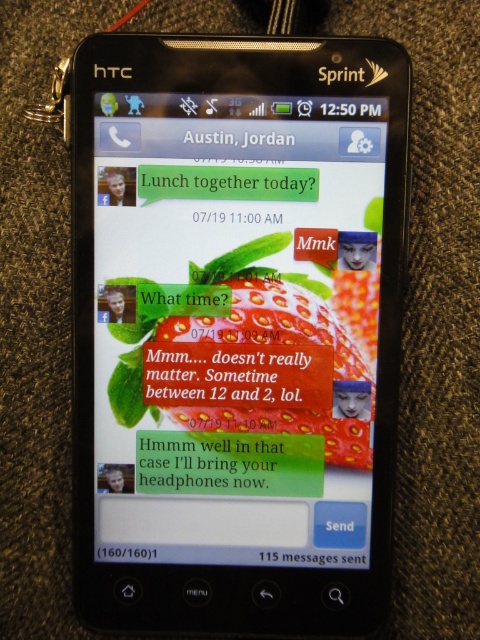
Is black plastic phone at center to the left of green matte text message at center from the viewer's perspective?

No, black plastic phone at center is not to the left of green matte text message at center.

Describe the element at coordinates (237, 317) in the screenshot. I see `black plastic phone at center` at that location.

Where is `black plastic phone at center`? Image resolution: width=480 pixels, height=640 pixels. black plastic phone at center is located at coordinates (237, 317).

Is black plastic phone at center positioned before matte plastic text message at center?

Yes.

Is point (132, 116) positioned before point (312, 381)?

Yes.

Between point (360, 472) and point (223, 390), which one is positioned in front?

Point (360, 472)

Identify the location of black plastic phone at center. The height and width of the screenshot is (640, 480). (237, 317).

Does point (208, 380) come closer to viewer compared to point (243, 477)?

No, (208, 380) is behind (243, 477).

Does matte plastic text message at center have a greater height compared to green matte text message at center?

Yes, matte plastic text message at center is taller than green matte text message at center.

Is point (156, 397) farther from camera compared to point (220, 433)?

Yes, it is behind point (220, 433).

Locate an element on the screen. matte plastic text message at center is located at coordinates (237, 374).